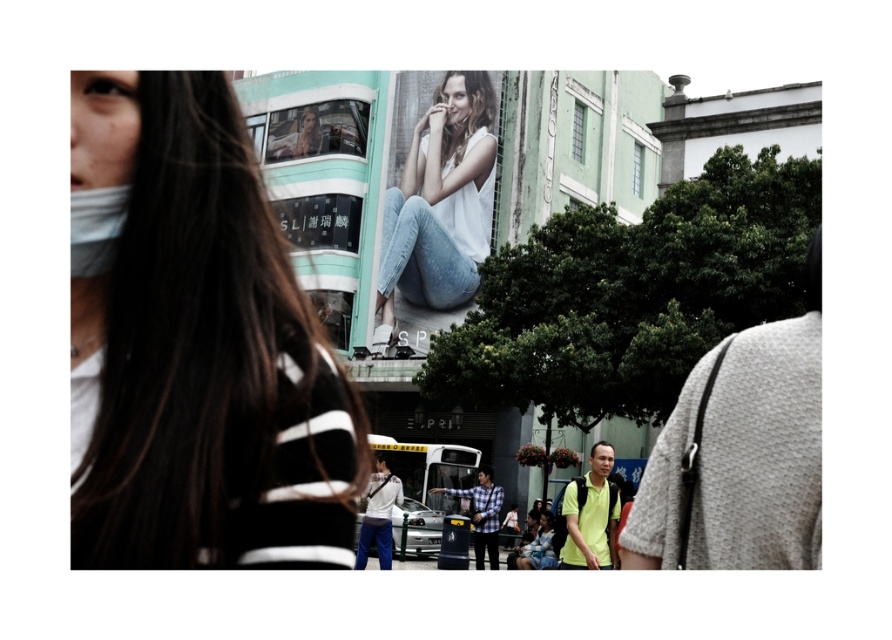
Question: Does white matte tank top at center appear over white matte mask at left?

Choices:
 (A) yes
 (B) no

Answer: (A)

Question: Which object is positioned closest to the white matte face mask at left?

Choices:
 (A) white matte tank top at center
 (B) white matte mask at left

Answer: (B)

Question: Is white matte face mask at left to the right of white matte tank top at center from the viewer's perspective?

Choices:
 (A) no
 (B) yes

Answer: (A)

Question: Which point appears closest to the camera in this image?

Choices:
 (A) (71, 195)
 (B) (248, 541)
 (C) (385, 285)

Answer: (B)

Question: Does white matte face mask at left have a smaller size compared to white matte mask at left?

Choices:
 (A) yes
 (B) no

Answer: (A)

Question: Among these points, which one is farthest from the camera?

Choices:
 (A) (416, 205)
 (B) (71, 532)
 (C) (95, 275)

Answer: (A)